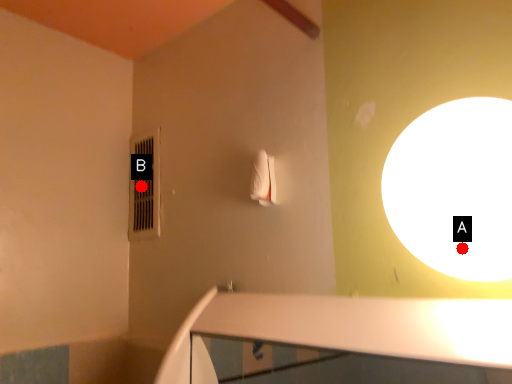
Question: Two points are circled on the image, labeled by A and B beside each circle. Which point appears closest to the camera in this image?

Choices:
 (A) A is closer
 (B) B is closer

Answer: (A)